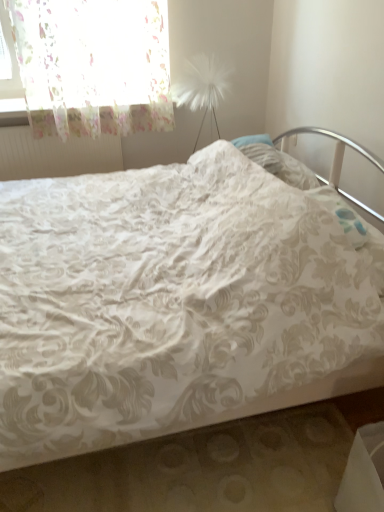
Question: Considering the relative sizes of white textured radiator at upper left and white floral fabric bed at center in the image provided, is white textured radiator at upper left bigger than white floral fabric bed at center?

Choices:
 (A) yes
 (B) no

Answer: (B)

Question: Is white textured radiator at upper left further to camera compared to white floral fabric bed at center?

Choices:
 (A) no
 (B) yes

Answer: (B)

Question: Does white textured radiator at upper left appear on the left side of white floral fabric bed at center?

Choices:
 (A) no
 (B) yes

Answer: (B)

Question: From a real-world perspective, is white textured radiator at upper left beneath white floral fabric bed at center?

Choices:
 (A) yes
 (B) no

Answer: (B)

Question: Does white textured radiator at upper left have a greater width compared to white floral fabric bed at center?

Choices:
 (A) yes
 (B) no

Answer: (B)

Question: Considering their positions, is white floral fabric bed at center located in front of or behind white textured radiator at upper left?

Choices:
 (A) front
 (B) behind

Answer: (A)

Question: Considering the relative positions of white floral fabric bed at center and white textured radiator at upper left in the image provided, is white floral fabric bed at center to the left or to the right of white textured radiator at upper left?

Choices:
 (A) left
 (B) right

Answer: (B)

Question: From their relative heights in the image, would you say white floral fabric bed at center is taller or shorter than white textured radiator at upper left?

Choices:
 (A) tall
 (B) short

Answer: (A)

Question: From the image's perspective, is white floral fabric bed at center above or below white textured radiator at upper left?

Choices:
 (A) above
 (B) below

Answer: (B)

Question: Is point (72, 80) positioned closer to the camera than point (185, 384)?

Choices:
 (A) closer
 (B) farther

Answer: (B)

Question: In the image, is translucent floral fabric at upper left on the left side or the right side of white floral fabric bed at center?

Choices:
 (A) left
 (B) right

Answer: (A)

Question: Is translucent floral fabric at upper left taller or shorter than white floral fabric bed at center?

Choices:
 (A) tall
 (B) short

Answer: (B)

Question: Considering the positions of translucent floral fabric at upper left and white floral fabric bed at center in the image, is translucent floral fabric at upper left bigger or smaller than white floral fabric bed at center?

Choices:
 (A) small
 (B) big

Answer: (A)

Question: In the image, is white textured radiator at upper left positioned in front of or behind white floral fabric bed at center?

Choices:
 (A) behind
 (B) front

Answer: (A)

Question: Considering the relative positions of white textured radiator at upper left and white floral fabric bed at center in the image provided, is white textured radiator at upper left to the left or to the right of white floral fabric bed at center?

Choices:
 (A) right
 (B) left

Answer: (B)